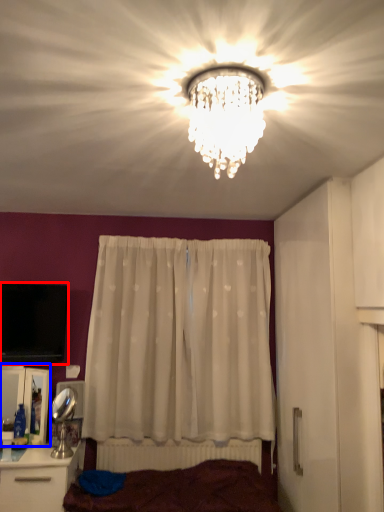
Question: Which of the following is the closest to the observer, television (highlighted by a red box) or cabinetry (highlighted by a blue box)?

Choices:
 (A) television
 (B) cabinetry

Answer: (B)